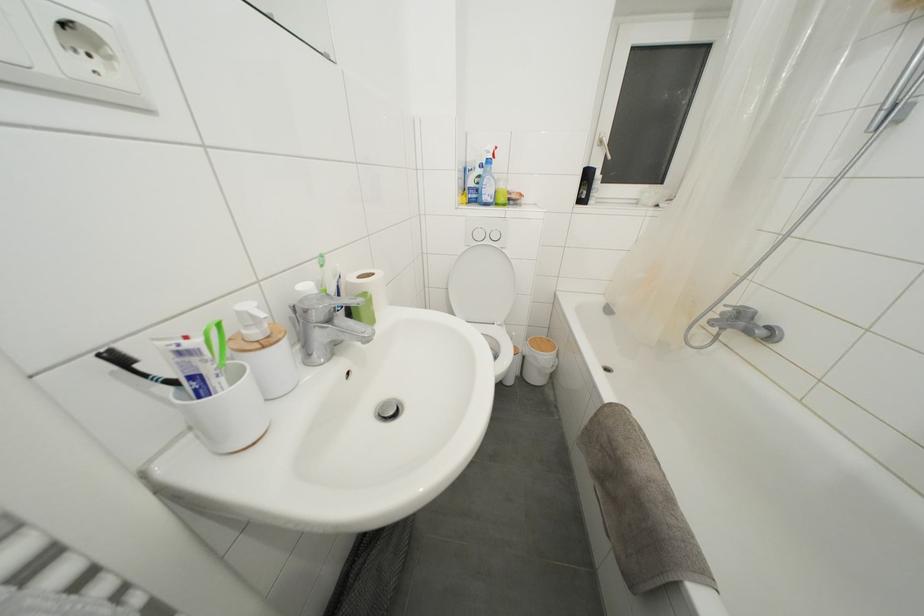
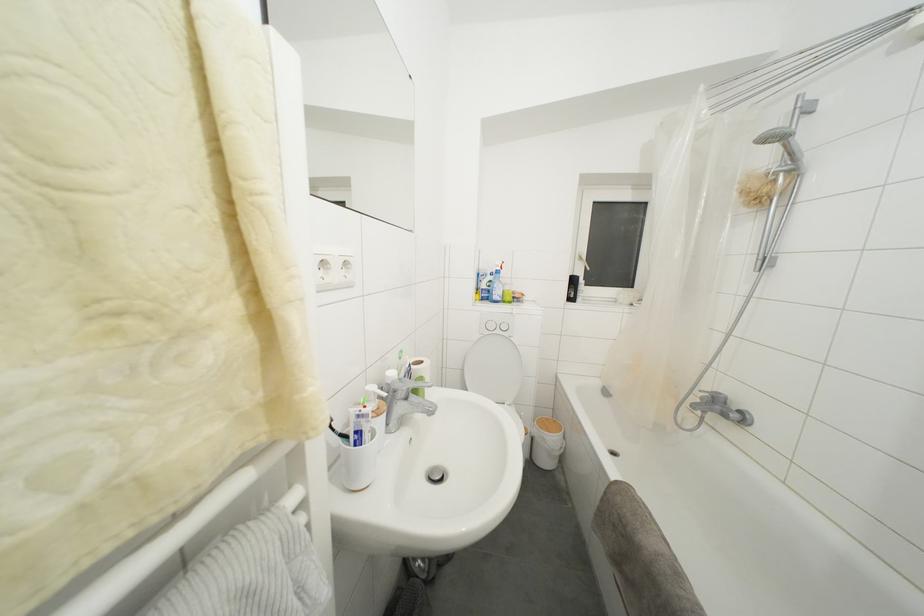
Locate, in the second image, the point that corresponds to (388,408) in the first image.

(436, 475)